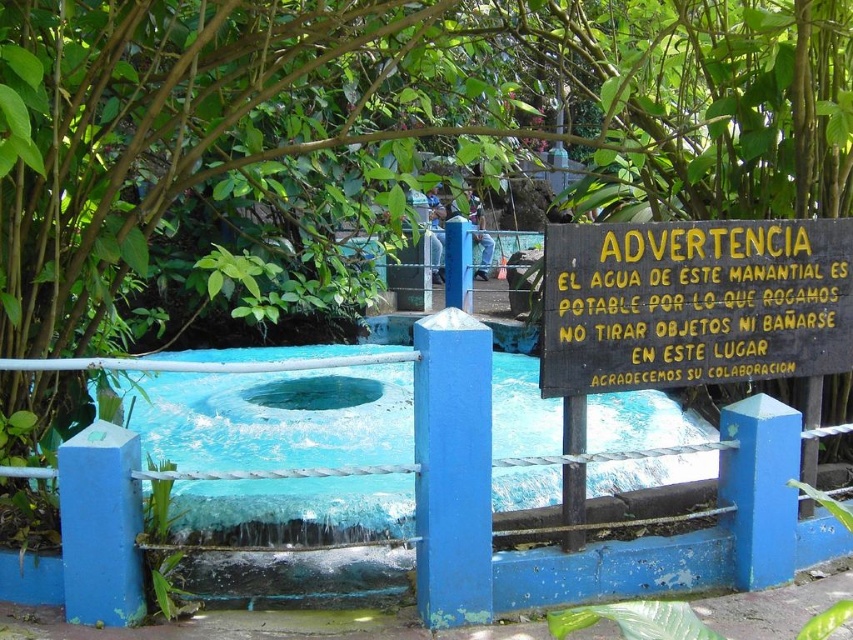
Question: Is blue concrete pool at center bigger than black wood sign at center?

Choices:
 (A) no
 (B) yes

Answer: (A)

Question: Is blue concrete pool at center to the left of black wood sign at center from the viewer's perspective?

Choices:
 (A) no
 (B) yes

Answer: (B)

Question: Can you confirm if blue concrete pool at center is positioned to the left of black wood sign at center?

Choices:
 (A) no
 (B) yes

Answer: (B)